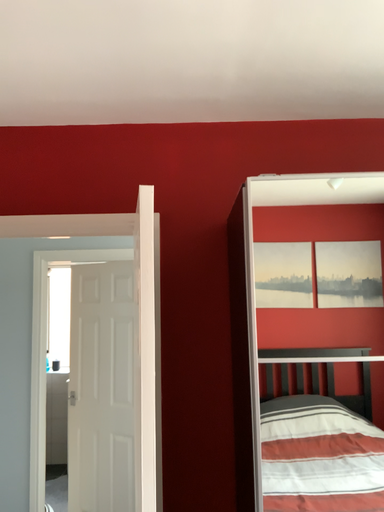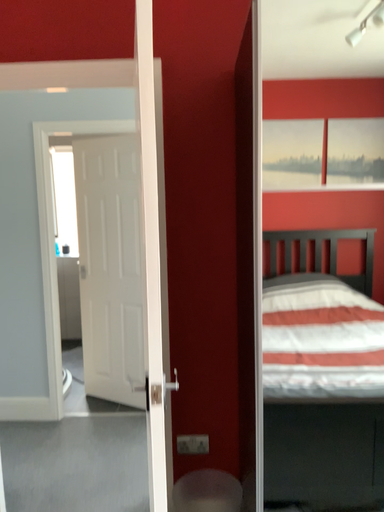
Question: How did the camera likely rotate when shooting the video?

Choices:
 (A) rotated upward
 (B) rotated downward

Answer: (B)